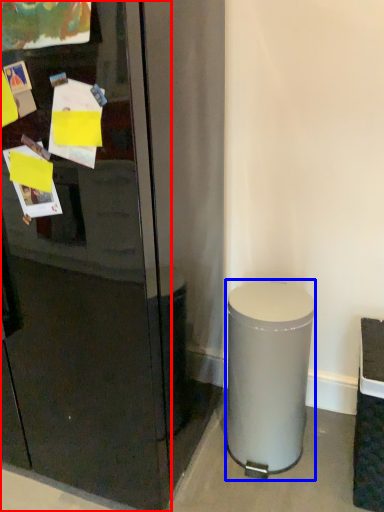
Question: Which object appears farthest to the camera in this image, glass door (highlighted by a red box) or trash bin/can (highlighted by a blue box)?

Choices:
 (A) glass door
 (B) trash bin/can

Answer: (B)